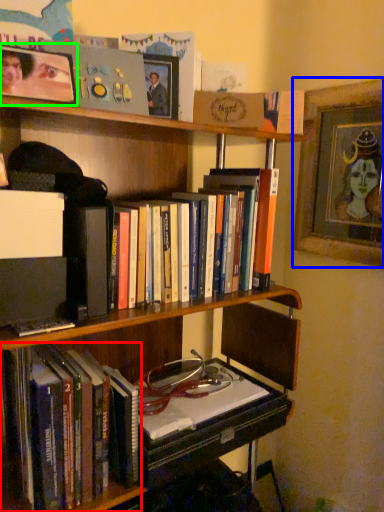
Question: Which object is positioned closest to book (highlighted by a red box)? Select from picture frame (highlighted by a blue box) and picture frame (highlighted by a green box).

Choices:
 (A) picture frame
 (B) picture frame

Answer: (B)